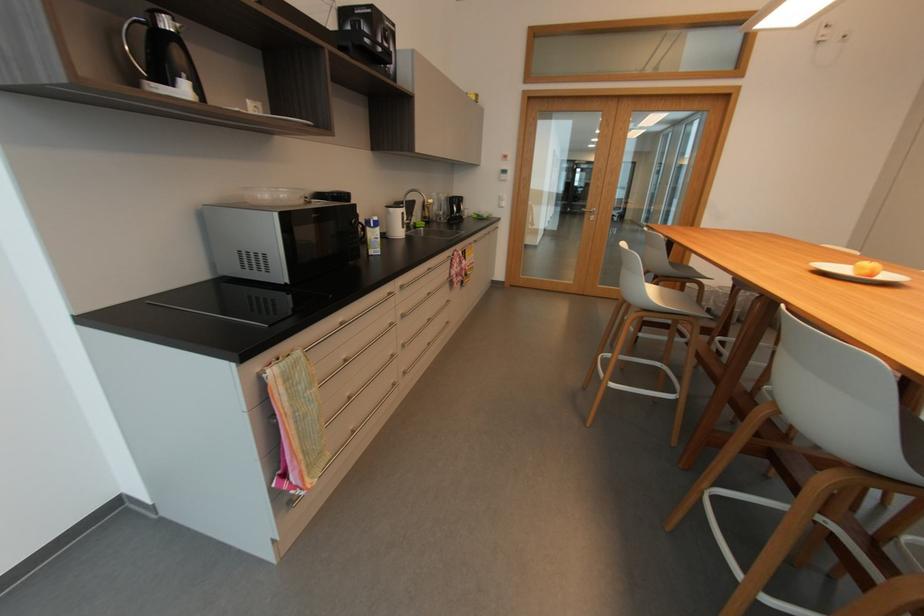
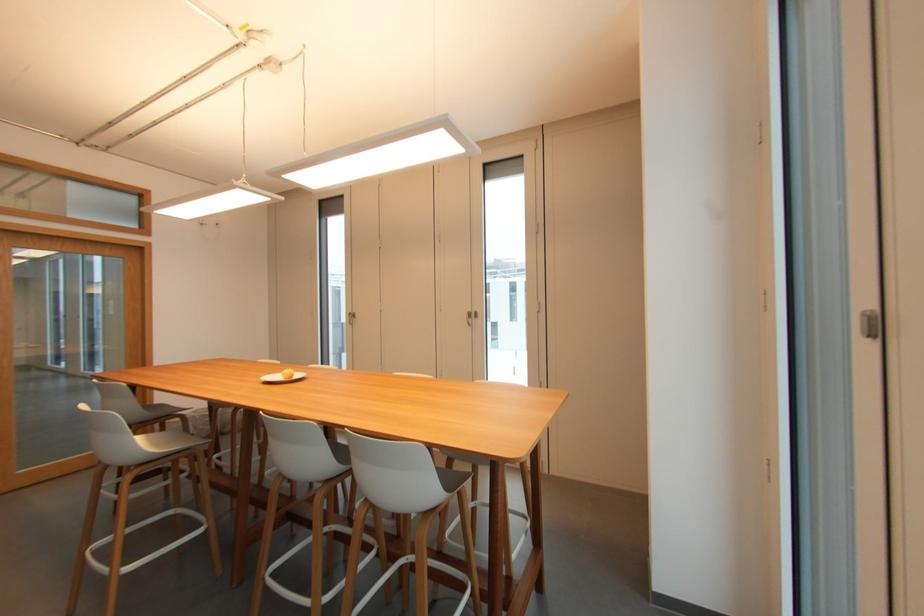
Find the pixel in the second image that matches (x=860, y=267) in the first image.

(287, 375)